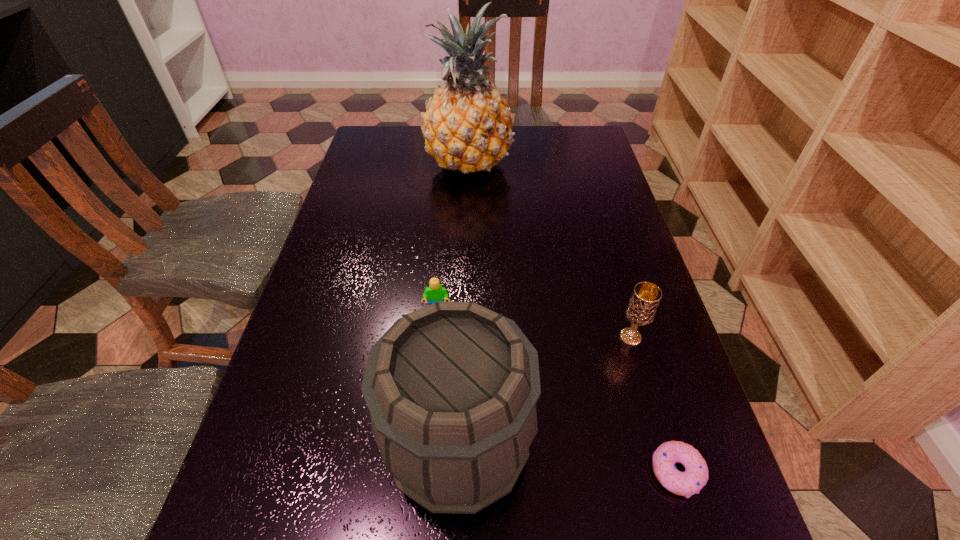
This screenshot has width=960, height=540. Identify the location of pineapple. (468, 126).

Where is `the tallest object`? Image resolution: width=960 pixels, height=540 pixels. the tallest object is located at coordinates (x=468, y=126).

Where is `the second tallest object`? This screenshot has width=960, height=540. the second tallest object is located at coordinates (451, 388).

Identify the location of the third farthest object. (641, 309).

The height and width of the screenshot is (540, 960). I want to click on the third tallest object, so click(641, 309).

This screenshot has height=540, width=960. In order to click on the fourth nearest object in this screenshot , I will do `click(435, 292)`.

You are a GUI agent. You are given a task and a screenshot of the screen. Output one action in this format:
    pyautogui.click(x=<x>, y=<y>)
    Task: Click on the Lego
    This screenshot has width=960, height=540.
    Given the screenshot: What is the action you would take?
    click(435, 292)

This screenshot has width=960, height=540. I want to click on the shortest object, so click(690, 482).

The height and width of the screenshot is (540, 960). I want to click on vacant space situated on the left of the tallest object, so coord(385,164).

Where is `vacant point located on the right of the wine bucket`? vacant point located on the right of the wine bucket is located at coordinates (643, 447).